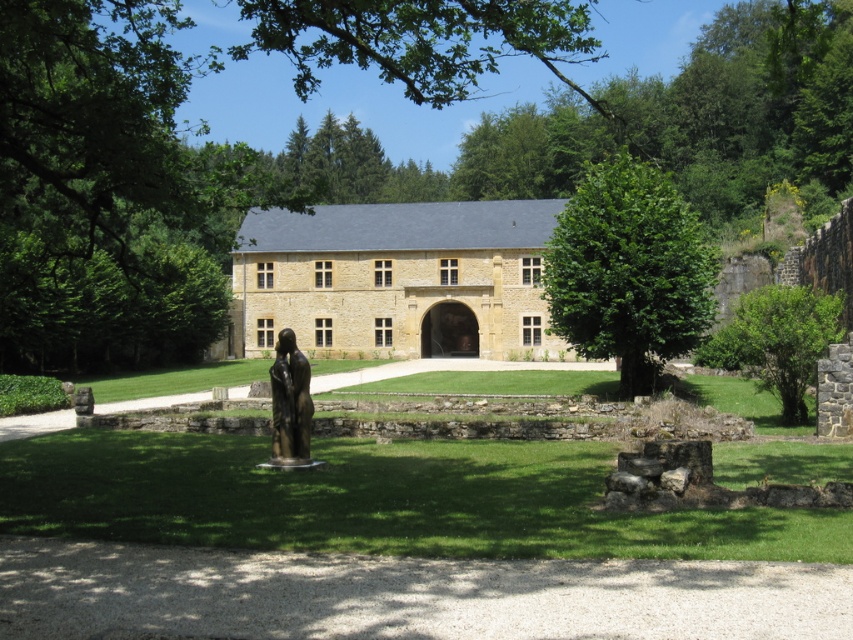
Question: Is green leafy tree at center positioned before bronze statue at center?

Choices:
 (A) no
 (B) yes

Answer: (A)

Question: Does green leafy tree at center appear on the left side of bronze statue at center?

Choices:
 (A) yes
 (B) no

Answer: (B)

Question: Which point is closer to the camera?

Choices:
 (A) (614, 349)
 (B) (277, 387)

Answer: (B)

Question: Can you confirm if green leafy tree at center is positioned to the left of bronze statue at center?

Choices:
 (A) yes
 (B) no

Answer: (B)

Question: Among these points, which one is nearest to the camera?

Choices:
 (A) (274, 380)
 (B) (689, 214)

Answer: (A)